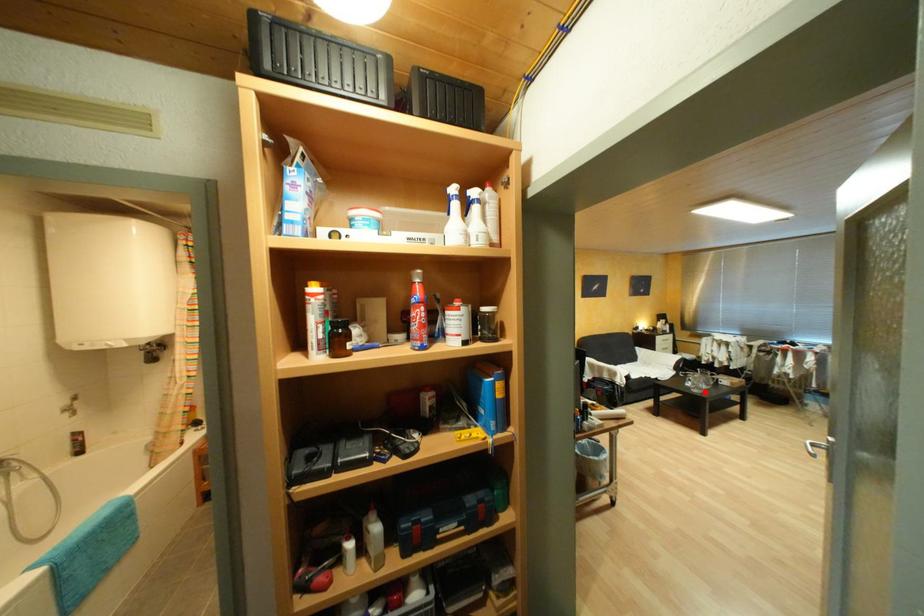
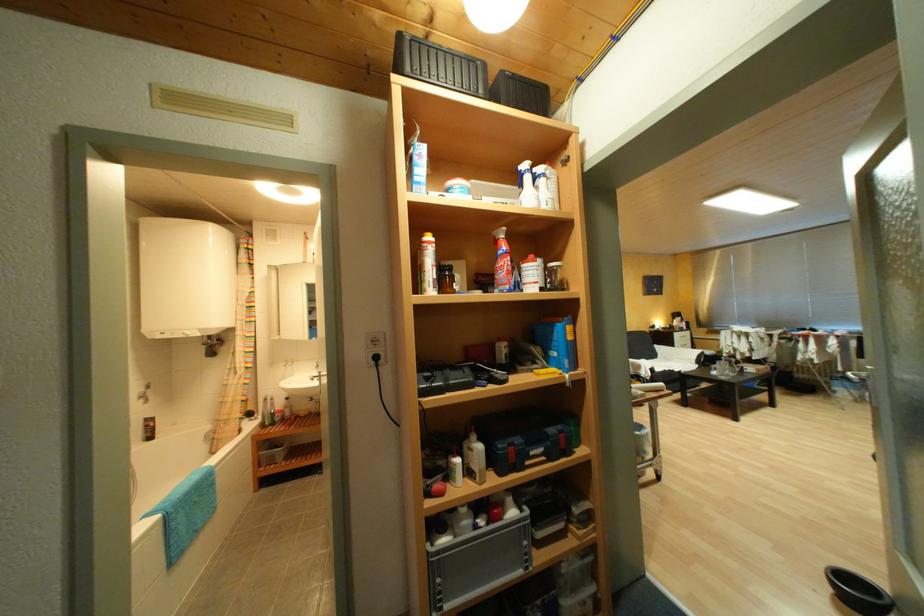
In the second image, find the point that corresponds to the highlighted location in the first image.

(732, 379)